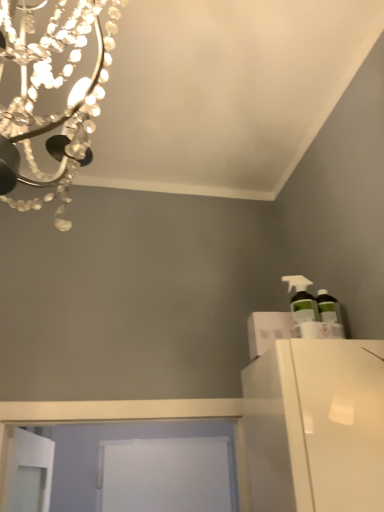
Describe the element at coordinates (55, 88) in the screenshot. The width and height of the screenshot is (384, 512). I see `clear crystal chandelier at upper left` at that location.

Identify the location of clear crystal chandelier at upper left. The height and width of the screenshot is (512, 384). (55, 88).

Where is `clear crystal chandelier at upper left`? clear crystal chandelier at upper left is located at coordinates (55, 88).